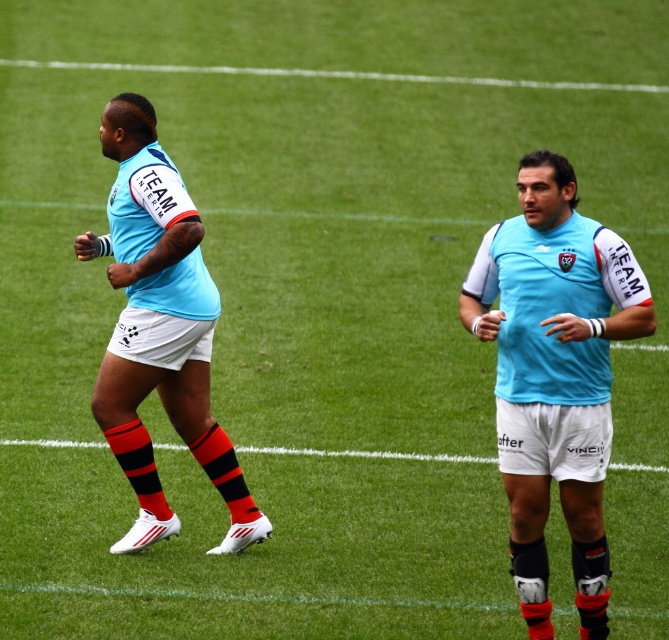
Question: Is light blue jersey at center above light blue jersey at left?

Choices:
 (A) no
 (B) yes

Answer: (A)

Question: Can you confirm if light blue jersey at center is positioned below light blue jersey at left?

Choices:
 (A) no
 (B) yes

Answer: (B)

Question: Which point is closer to the camera taking this photo?

Choices:
 (A) (518, 308)
 (B) (246, 538)

Answer: (A)

Question: Is light blue jersey at center thinner than light blue jersey at left?

Choices:
 (A) yes
 (B) no

Answer: (A)